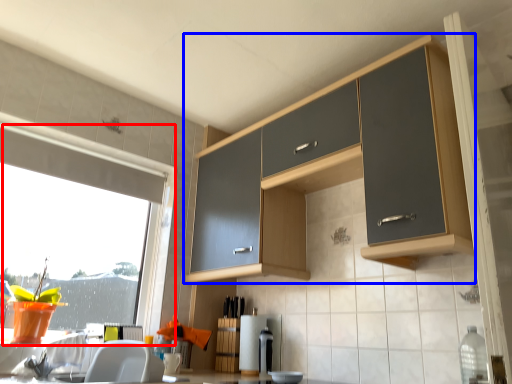
Question: Among these objects, which one is farthest to the camera, window (highlighted by a red box) or cabinetry (highlighted by a blue box)?

Choices:
 (A) window
 (B) cabinetry

Answer: (A)